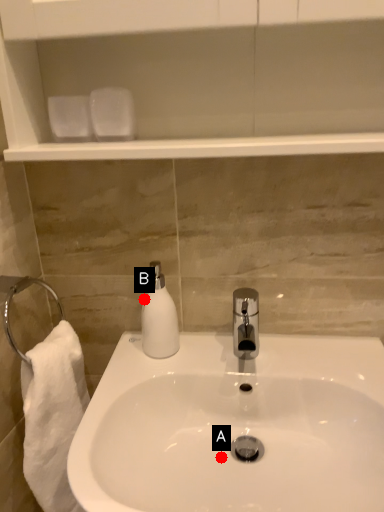
Question: Two points are circled on the image, labeled by A and B beside each circle. Among these points, which one is nearest to the camera?

Choices:
 (A) A is closer
 (B) B is closer

Answer: (A)